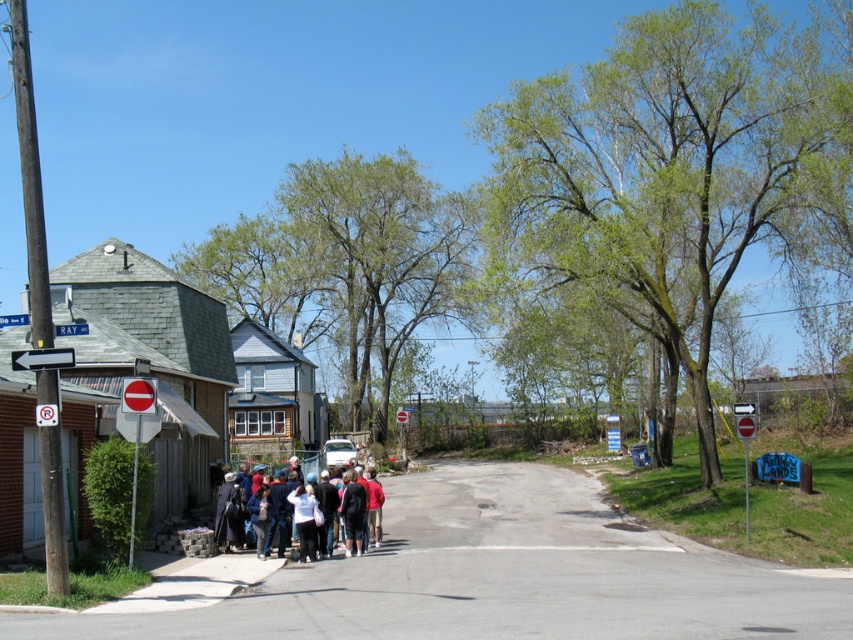
Who is positioned more to the left, dark blue jacket at center or white plastic arrow at left?

Positioned to the left is white plastic arrow at left.

Can you confirm if dark blue jacket at center is taller than white plastic arrow at left?

Indeed, dark blue jacket at center has a greater height compared to white plastic arrow at left.

Measure the distance between dark blue jacket at center and camera.

dark blue jacket at center is 55.64 feet away from camera.

At what (x,y) coordinates should I click in order to perform the action: click on dark blue jacket at center. Please return your answer as a coordinate pair (x, y). The width and height of the screenshot is (853, 640). Looking at the image, I should click on (320, 518).

Does white plastic arrow at left have a smaller size compared to red plastic stop sign at center?

Incorrect, white plastic arrow at left is not smaller in size than red plastic stop sign at center.

Is the position of white plastic arrow at left more distant than that of red plastic stop sign at center?

No, white plastic arrow at left is closer to the viewer.

Does point (45, 349) lie in front of point (122, 410)?

Yes, point (45, 349) is closer to viewer.

The image size is (853, 640). I want to click on white plastic arrow at left, so click(42, 358).

Between point (361, 531) and point (128, 401), which one is positioned behind?

The point (361, 531) is behind.

This screenshot has width=853, height=640. Identify the location of dark blue jacket at center. 320,518.